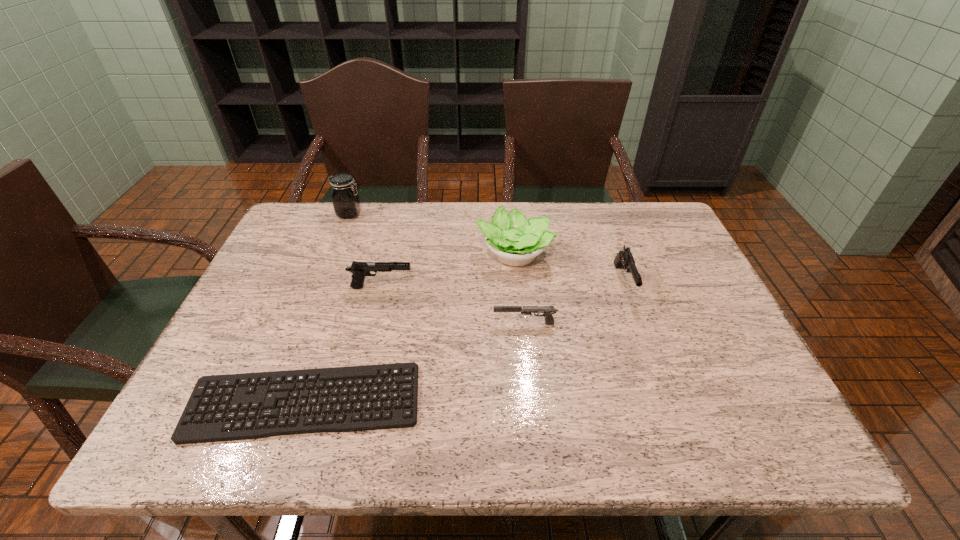
Locate an element on the screen. The width and height of the screenshot is (960, 540). empty space that is in between the second nearest object and the rightmost gun is located at coordinates (574, 303).

Locate an element on the screen. free area in between the farthest object and the leftmost gun is located at coordinates (366, 251).

The width and height of the screenshot is (960, 540). Find the location of `free space that is in between the leftmost gun and the nearest object`. free space that is in between the leftmost gun and the nearest object is located at coordinates (343, 345).

At what (x,y) coordinates should I click in order to perform the action: click on free space that is in between the lettuce and the shortest object. Please return your answer as a coordinate pair (x, y). Image resolution: width=960 pixels, height=540 pixels. Looking at the image, I should click on [409, 328].

Locate an element on the screen. vacant area that lies between the second nearest object and the farthest object is located at coordinates (437, 268).

The height and width of the screenshot is (540, 960). I want to click on vacant region between the rightmost gun and the nearest object, so click(464, 342).

Identify the location of object that stands as the closest to the lettuce. (624, 259).

Identify which object is located as the fifth nearest to the computer keyboard. Please provide its 2D coordinates. Your answer should be formatted as a tuple, i.e. [(x, y)], where the tuple contains the x and y coordinates of a point satisfying the conditions above.

[(346, 202)]

Identify which gun is the second closest to the lettuce. Please provide its 2D coordinates. Your answer should be formatted as a tuple, i.e. [(x, y)], where the tuple contains the x and y coordinates of a point satisfying the conditions above.

[(547, 311)]

Locate which gun is the second closest to the leftmost gun. Please provide its 2D coordinates. Your answer should be formatted as a tuple, i.e. [(x, y)], where the tuple contains the x and y coordinates of a point satisfying the conditions above.

[(624, 259)]